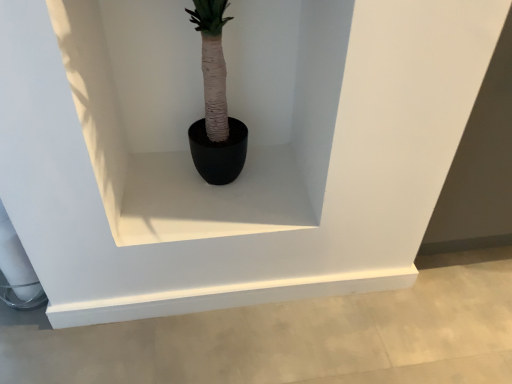
Question: Does point [x=318, y=135] appear closer or farther from the camera than point [x=180, y=223]?

Choices:
 (A) closer
 (B) farther

Answer: (A)

Question: In terms of height, does black matte pot at center look taller or shorter compared to white matte window sill at center?

Choices:
 (A) short
 (B) tall

Answer: (B)

Question: Is black matte pot at center wider or thinner than white matte window sill at center?

Choices:
 (A) wide
 (B) thin

Answer: (B)

Question: From the image's perspective, is white matte window sill at center positioned above or below black matte pot at center?

Choices:
 (A) above
 (B) below

Answer: (B)

Question: Does point (204, 206) appear closer or farther from the camera than point (118, 92)?

Choices:
 (A) closer
 (B) farther

Answer: (A)

Question: Considering the relative positions of white matte window sill at center and black matte pot at center in the image provided, is white matte window sill at center to the left or to the right of black matte pot at center?

Choices:
 (A) right
 (B) left

Answer: (B)

Question: Considering the positions of white matte window sill at center and black matte pot at center in the image, is white matte window sill at center bigger or smaller than black matte pot at center?

Choices:
 (A) big
 (B) small

Answer: (B)